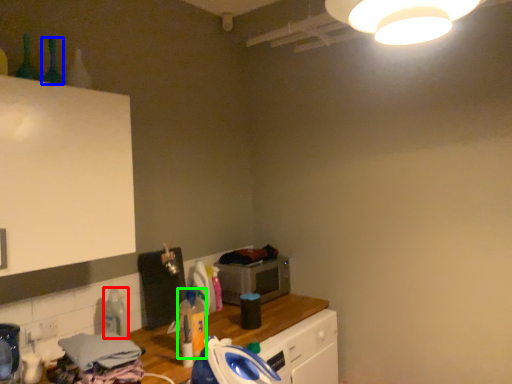
Question: Estimate the real-world distances between objects in this image. Which object is farther from bottle (highlighted by a red box), bottle (highlighted by a blue box) or bottle (highlighted by a green box)?

Choices:
 (A) bottle
 (B) bottle

Answer: (A)